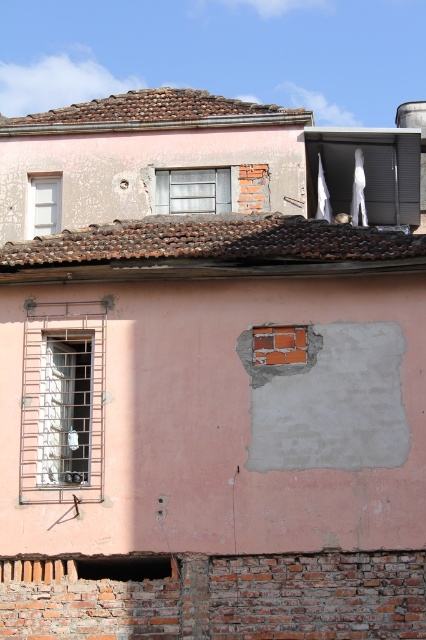
You are standing at a distance from the building and want to throw a ball to hit the point at coordinates point (51,384). If your throwing range is 20 meters, will you be able to reach it?

The point at coordinates point (51,384) is 21.65 meters away from the viewer. Since your throwing range is only 20 meters, you won